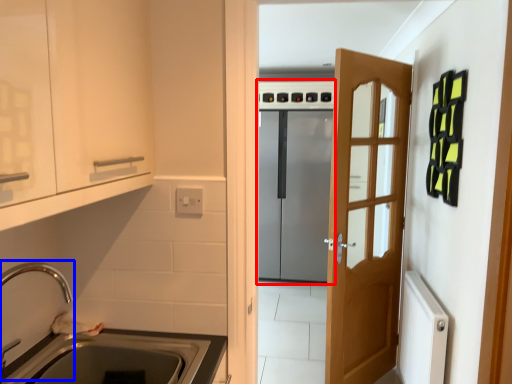
Question: Among these objects, which one is farthest to the camera, appliance (highlighted by a red box) or faucet (highlighted by a blue box)?

Choices:
 (A) appliance
 (B) faucet

Answer: (A)